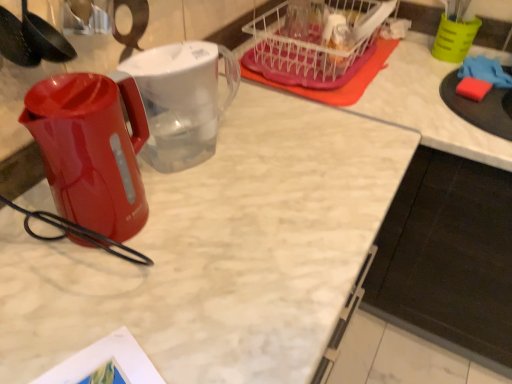
Find the location of a particular element. This screenshot has width=512, height=384. space that is in front of glossy plastic kettle at left is located at coordinates (92, 298).